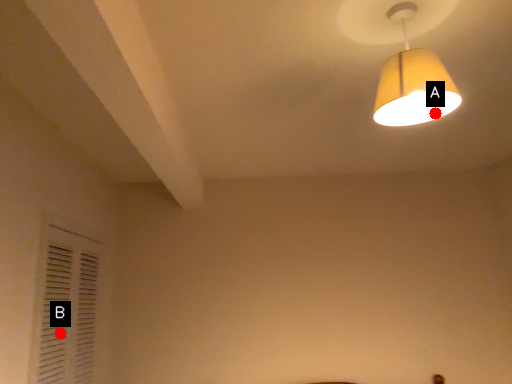
Question: Two points are circled on the image, labeled by A and B beside each circle. Which point appears closest to the camera in this image?

Choices:
 (A) A is closer
 (B) B is closer

Answer: (A)